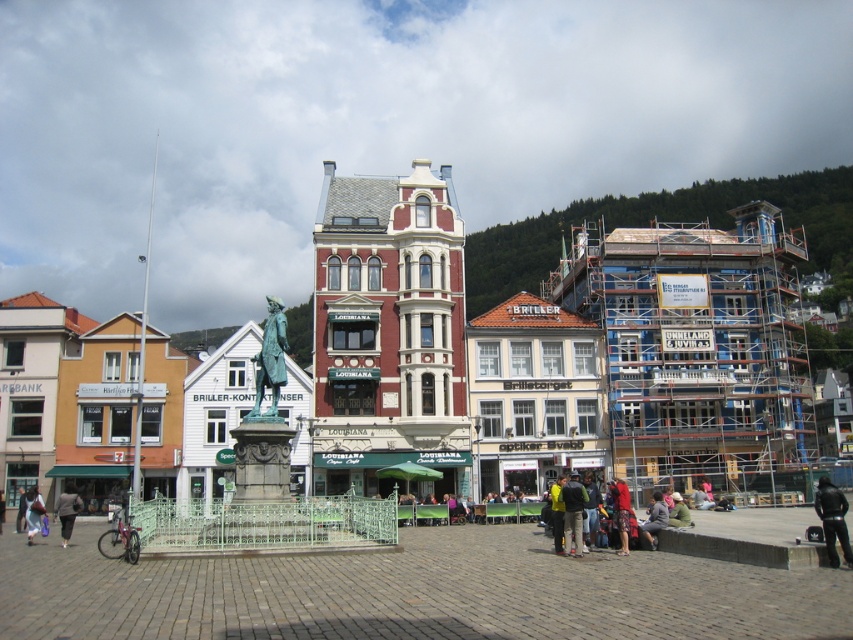
Question: Is bronze statue at center positioned before dark gray fabric jacket at lower left?

Choices:
 (A) no
 (B) yes

Answer: (B)

Question: Based on their relative distances, which object is nearer to the black leather jacket at lower right?

Choices:
 (A) red fabric dress at lower center
 (B) dark gray fabric jacket at lower right
 (C) green patinated bronze statue at center
 (D) light brown leather jacket at lower left

Answer: (B)

Question: Which object is farther from the camera taking this photo?

Choices:
 (A) dark gray fabric jacket at lower right
 (B) dark green jacket at lower center
 (C) dark gray fabric jacket at lower left
 (D) green patinated bronze statue at center

Answer: (C)

Question: Can you confirm if red brick building at center is smaller than dark green jacket at lower center?

Choices:
 (A) yes
 (B) no

Answer: (B)

Question: Can you confirm if green patinated bronze statue at center is wider than dark gray fabric jacket at lower right?

Choices:
 (A) no
 (B) yes

Answer: (B)

Question: Estimate the real-world distances between objects in this image. Which object is closer to the dark gray fabric jacket at lower left?

Choices:
 (A) green patinated bronze statue at center
 (B) dark gray fabric jacket at lower right
 (C) red fabric dress at lower center
 (D) red brick building at center

Answer: (A)